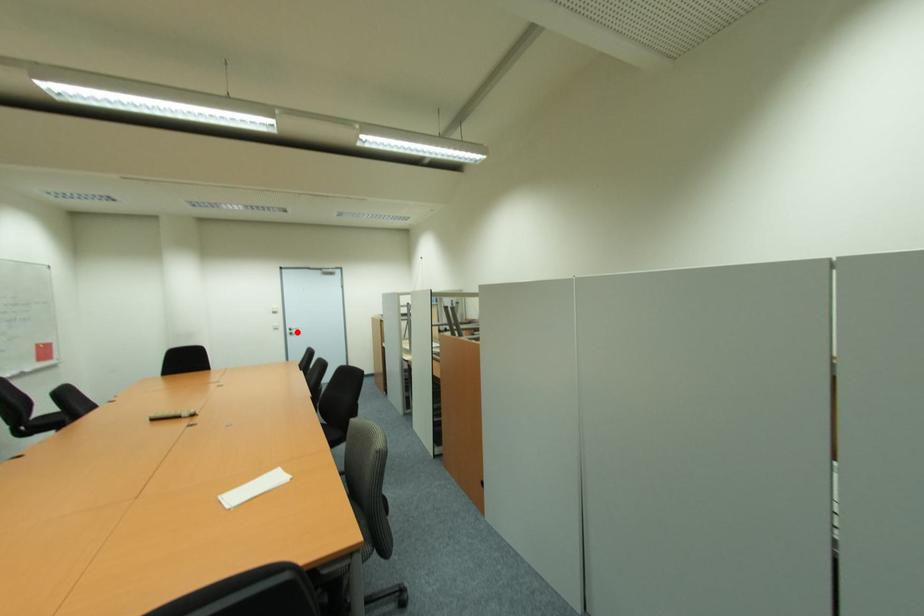
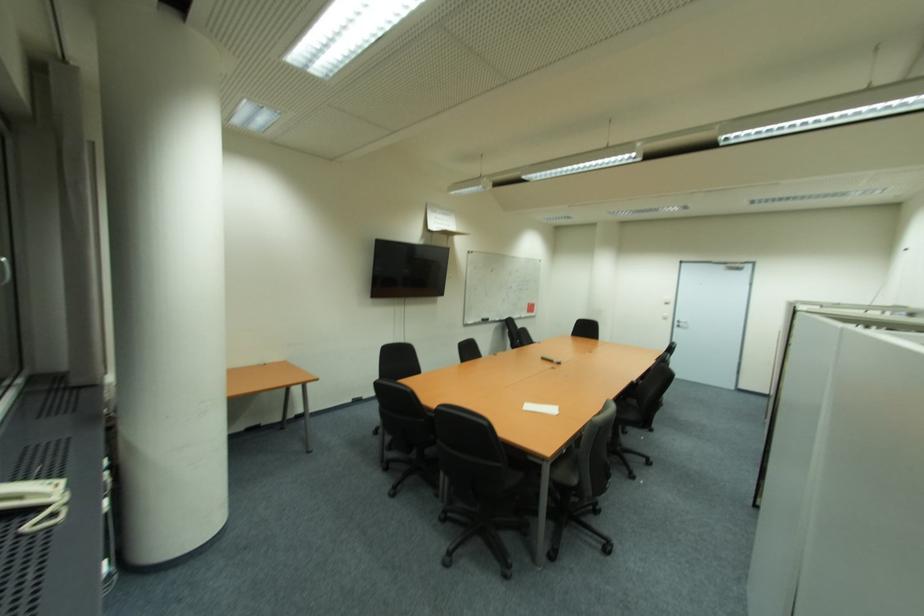
Find the pixel in the second image that matches the highlighted location in the first image.

(686, 325)